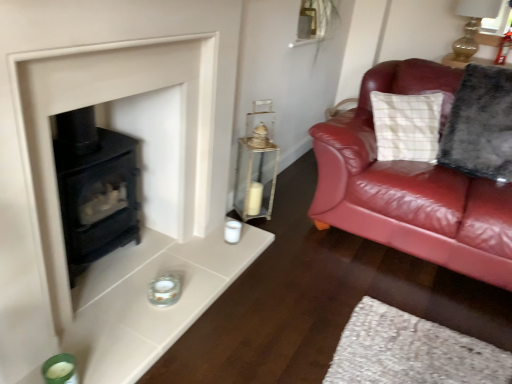
At what (x,y) coordinates should I click in order to perform the action: click on vacant space to the right of matte glass candle holder at lower center, which ranks as the 1th candle holder in top-to-bottom order. Please return your answer as a coordinate pair (x, y). This screenshot has width=512, height=384. Looking at the image, I should click on (212, 322).